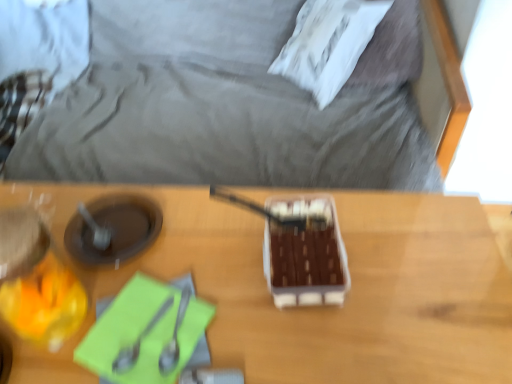
Locate an element on the screen. vacant area that lies between satin silver spoon at center, the second utensil positioned from the left, and brown matte chocolate bar at center is located at coordinates (254, 294).